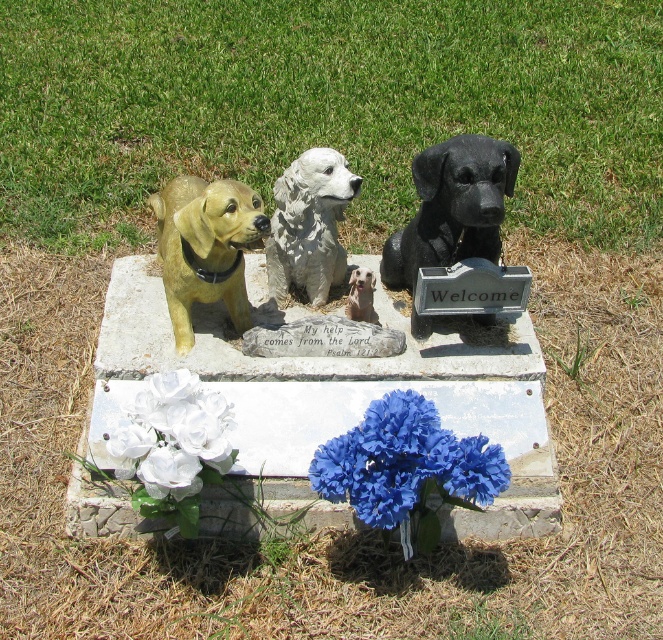
Question: Can you confirm if shiny black statue at center is wider than smooth beige dog at center?

Choices:
 (A) yes
 (B) no

Answer: (A)

Question: Which object is positioned farthest from the smooth beige dog at center?

Choices:
 (A) white glossy statue at center
 (B) golden matte dog at left
 (C) blue fabric flowers at center
 (D) shiny black statue at center

Answer: (C)

Question: Is blue fabric flowers at center below shiny black statue at center?

Choices:
 (A) no
 (B) yes

Answer: (B)

Question: Estimate the real-world distances between objects in this image. Which object is closer to the shiny black statue at center?

Choices:
 (A) golden matte dog at left
 (B) blue fabric flowers at center
 (C) smooth beige dog at center
 (D) white silk flowers at lower left

Answer: (C)

Question: Considering the relative positions of golden matte dog at left and white silk flowers at lower left in the image provided, where is golden matte dog at left located with respect to white silk flowers at lower left?

Choices:
 (A) left
 (B) right

Answer: (B)

Question: Which object is closer to the camera taking this photo?

Choices:
 (A) shiny black statue at center
 (B) white glossy statue at center

Answer: (A)